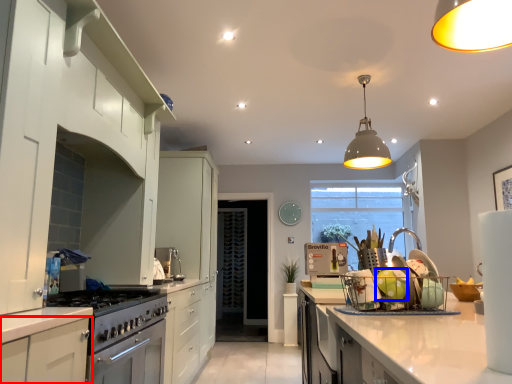
Question: Which of the following is the closest to the observer, cabinetry (highlighted by a red box) or food (highlighted by a blue box)?

Choices:
 (A) cabinetry
 (B) food

Answer: (A)